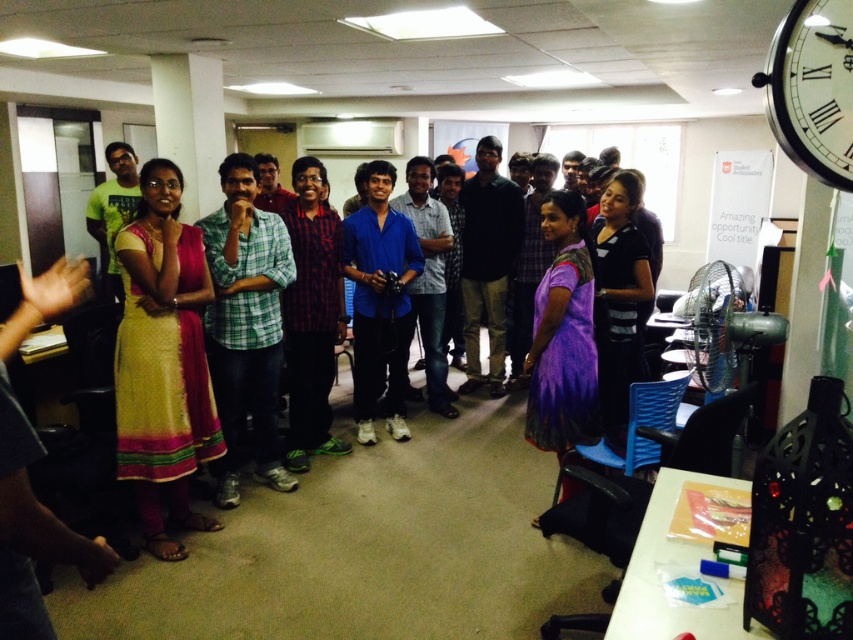
Question: Is yellow cotton dress at left closer to the viewer compared to white glossy clock at upper right?

Choices:
 (A) yes
 (B) no

Answer: (B)

Question: Which point is farther from the camera taking this photo?

Choices:
 (A) (170, 356)
 (B) (831, 68)
 (C) (216, 378)
 (D) (577, 604)

Answer: (C)

Question: Which point is farther from the camera taking this photo?

Choices:
 (A) pos(138,358)
 (B) pos(848,60)
 (C) pos(234,356)

Answer: (C)

Question: Can you confirm if yellow cotton dress at left is positioned below white glossy clock at upper right?

Choices:
 (A) yes
 (B) no

Answer: (A)

Question: Does matte yellow dress at center come behind blue matte shirt at center?

Choices:
 (A) no
 (B) yes

Answer: (A)

Question: Which point is closer to the camera taking this photo?

Choices:
 (A) (125, 605)
 (B) (402, 260)

Answer: (A)